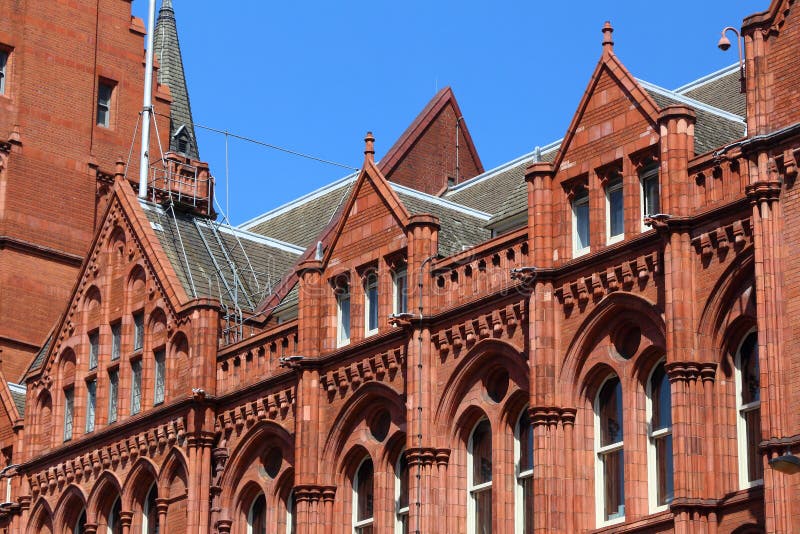
This screenshot has height=534, width=800. Find the location of `security camera`. security camera is located at coordinates (722, 42).